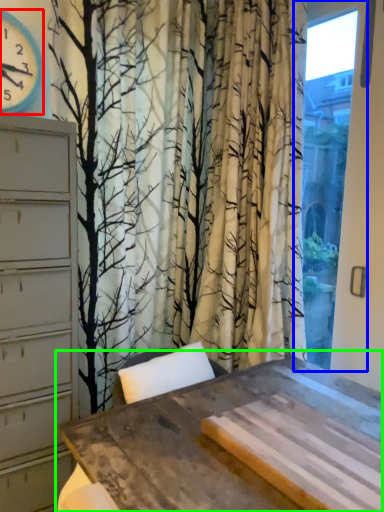
Question: Which object is positioned farthest from clock (highlighted by a red box)? Select from window (highlighted by a blue box) and table (highlighted by a green box).

Choices:
 (A) window
 (B) table

Answer: (B)